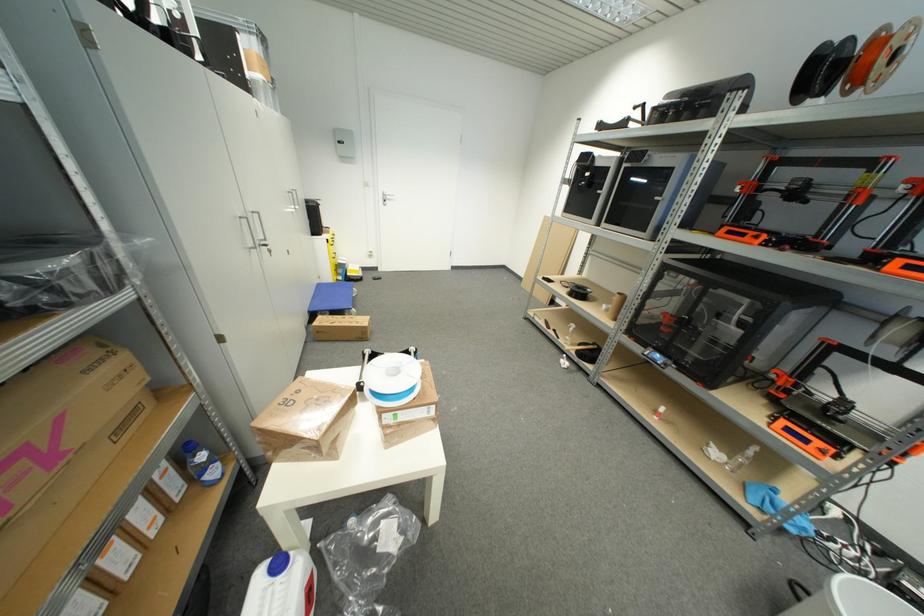
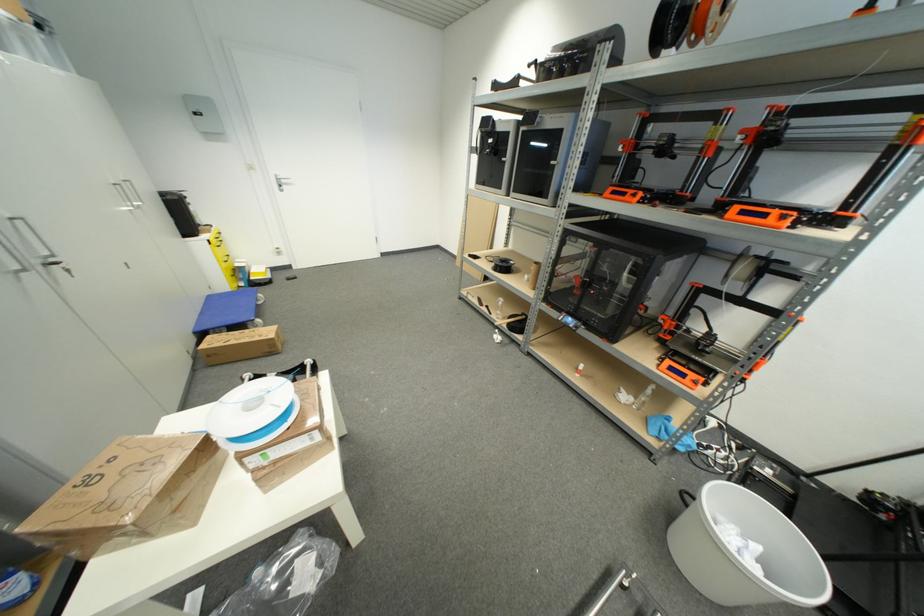
Find the pixel in the second image that matches (x=794, y=432) in the first image.

(675, 371)